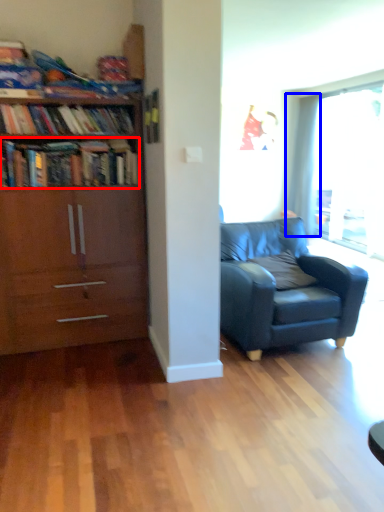
Question: Among these objects, which one is farthest to the camera, book (highlighted by a red box) or curtain (highlighted by a blue box)?

Choices:
 (A) book
 (B) curtain

Answer: (B)